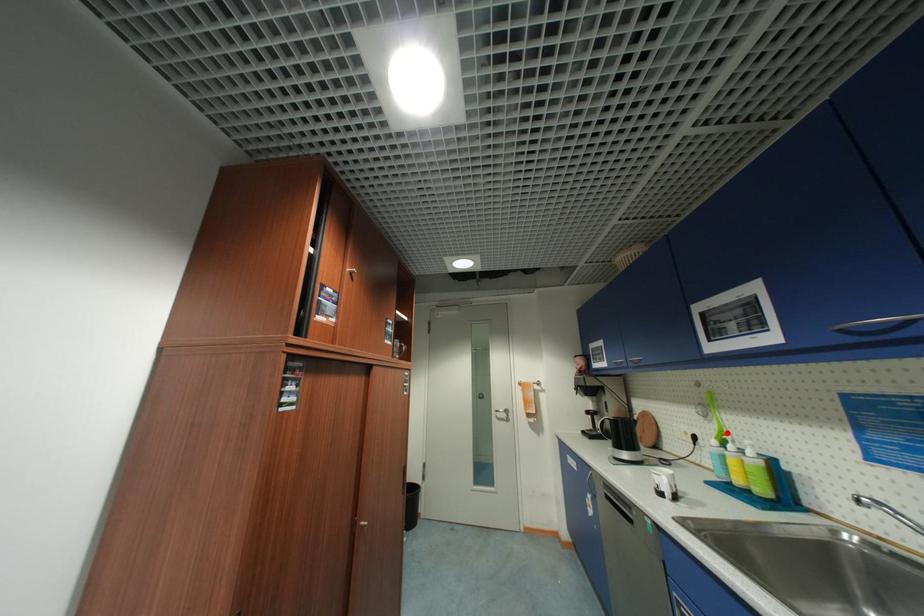
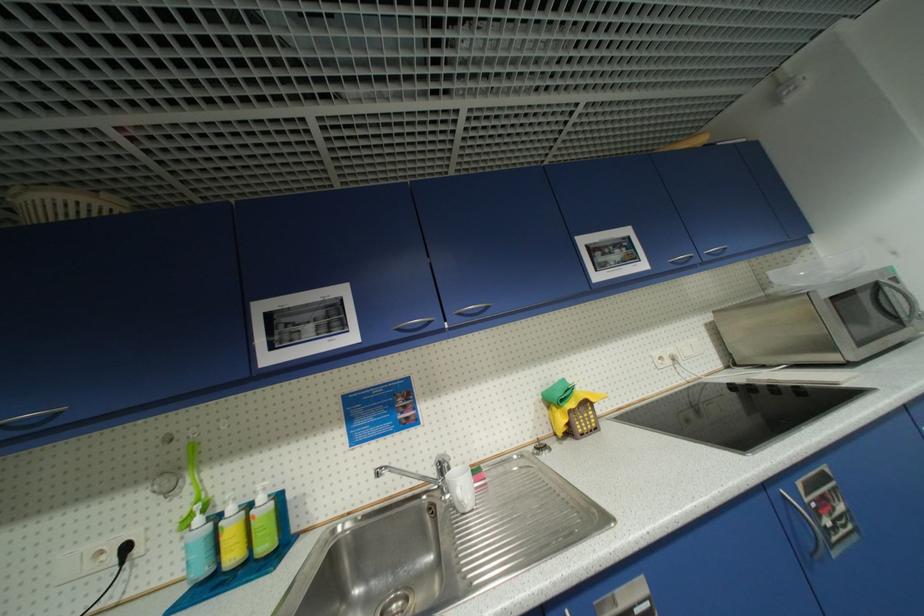
Where in the second image is the point corresponding to the highlighted location from the first image?

(203, 501)